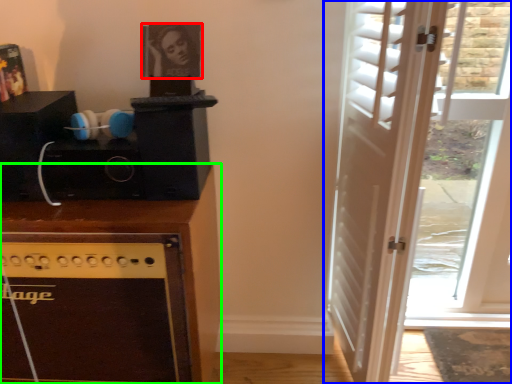
Question: Which object is positioned closest to picture frame (highlighted by a red box)? Select from door (highlighted by a blue box) and cabinetry (highlighted by a green box).

Choices:
 (A) door
 (B) cabinetry

Answer: (B)